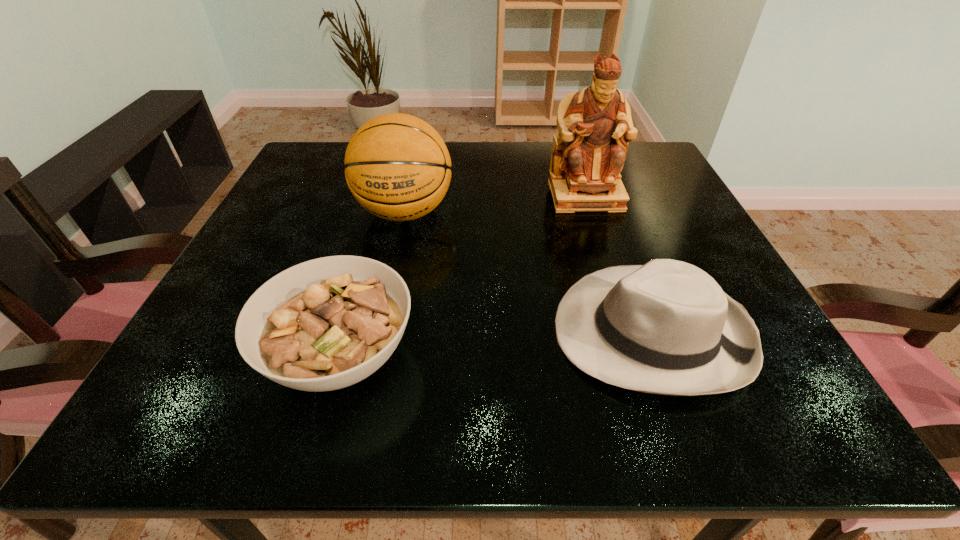
Find the location of a particular element. The image size is (960, 540). vacant point located between the figurine and the stew is located at coordinates (464, 275).

Where is `vacant region between the stew and the figurine`? Image resolution: width=960 pixels, height=540 pixels. vacant region between the stew and the figurine is located at coordinates (464, 275).

Where is `vacant area that lies between the fedora and the stew`? The height and width of the screenshot is (540, 960). vacant area that lies between the fedora and the stew is located at coordinates (496, 344).

I want to click on free area in between the fedora and the stew, so click(x=496, y=344).

Locate which object is the closest to the tallest object. Please provide its 2D coordinates. Your answer should be formatted as a tuple, i.e. [(x, y)], where the tuple contains the x and y coordinates of a point satisfying the conditions above.

[(667, 327)]

Locate an element on the screen. The height and width of the screenshot is (540, 960). object that is the second closest to the stew is located at coordinates (667, 327).

Where is `free space that satisfies the following two spatial constraints: 1. on the front-facing side of the fedora; 2. on the front side of the stew`? free space that satisfies the following two spatial constraints: 1. on the front-facing side of the fedora; 2. on the front side of the stew is located at coordinates (660, 355).